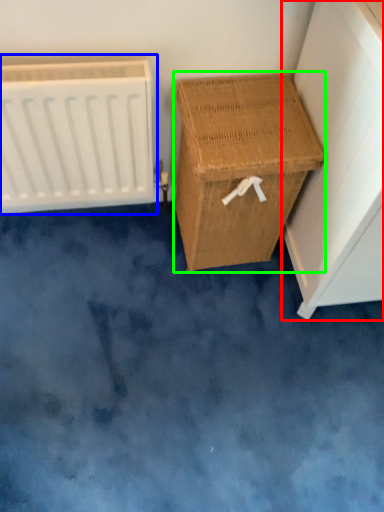
Question: Which object is positioned closest to furniture (highlighted by a red box)? Select from radiator (highlighted by a blue box) and furniture (highlighted by a green box).

Choices:
 (A) radiator
 (B) furniture

Answer: (B)